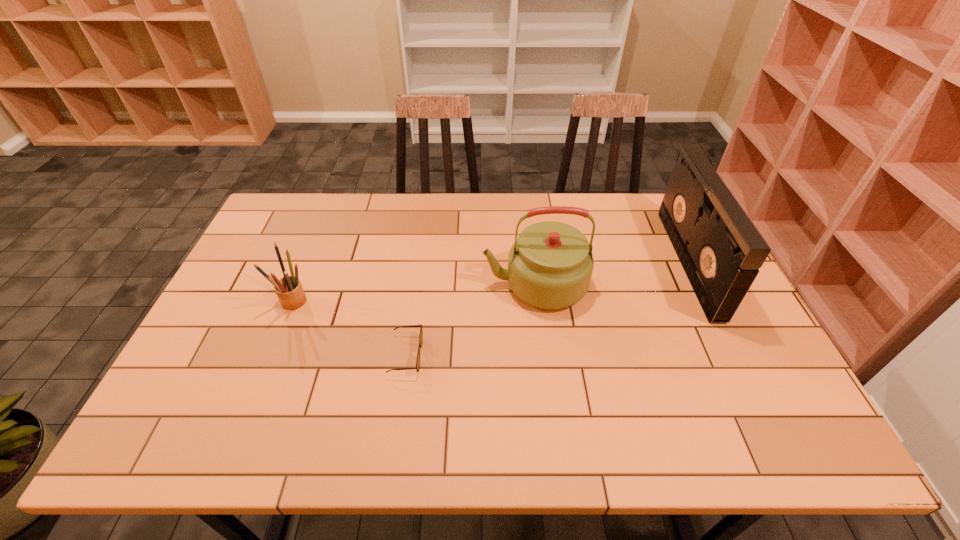
This screenshot has width=960, height=540. I want to click on vacant space at the left edge, so click(258, 295).

In the image, there is a desktop. Identify the location of vacant space at the right edge. (749, 379).

Where is `free space between the leftmost object and the shortest object`? The image size is (960, 540). free space between the leftmost object and the shortest object is located at coordinates (350, 328).

You are a GUI agent. You are given a task and a screenshot of the screen. Output one action in this format:
    pyautogui.click(x=<x>, y=<y>)
    Task: Click on the vacant area between the third tallest object and the kettle
    
    Given the screenshot: What is the action you would take?
    pyautogui.click(x=415, y=292)

The width and height of the screenshot is (960, 540). Find the location of `free space between the leftmost object and the third object from right to left`. free space between the leftmost object and the third object from right to left is located at coordinates (350, 328).

Identify the location of free space between the second object from right to left and the second shortest object. The height and width of the screenshot is (540, 960). (415, 292).

Locate an element on the screen. The height and width of the screenshot is (540, 960). empty space that is in between the leftmost object and the sunglasses is located at coordinates (350, 328).

I want to click on vacant area that lies between the videotape and the second shortest object, so click(x=492, y=281).

Where is `vacant area between the second object from left to right and the leftmost object`? Image resolution: width=960 pixels, height=540 pixels. vacant area between the second object from left to right and the leftmost object is located at coordinates (350, 328).

At what (x,y) coordinates should I click in order to perform the action: click on vacant area that lies between the kettle and the second shortest object. Please return your answer as a coordinate pair (x, y). Looking at the image, I should click on (x=415, y=292).